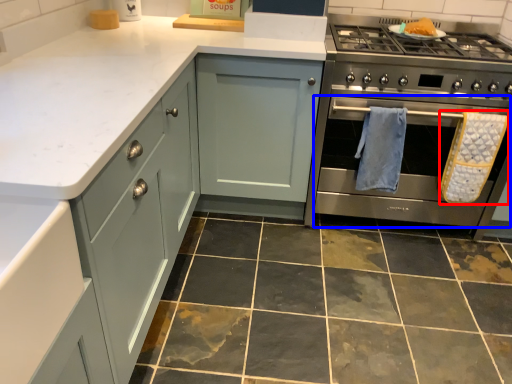
Question: Which object appears farthest to the camera in this image, bath towel (highlighted by a red box) or oven (highlighted by a blue box)?

Choices:
 (A) bath towel
 (B) oven

Answer: (A)